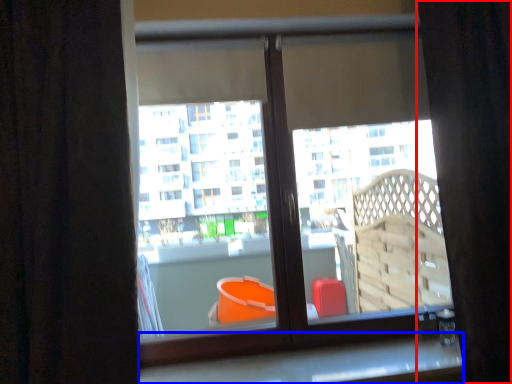
Question: Among these objects, which one is nearest to the camera, curtain (highlighted by a red box) or window sill (highlighted by a blue box)?

Choices:
 (A) curtain
 (B) window sill

Answer: (A)